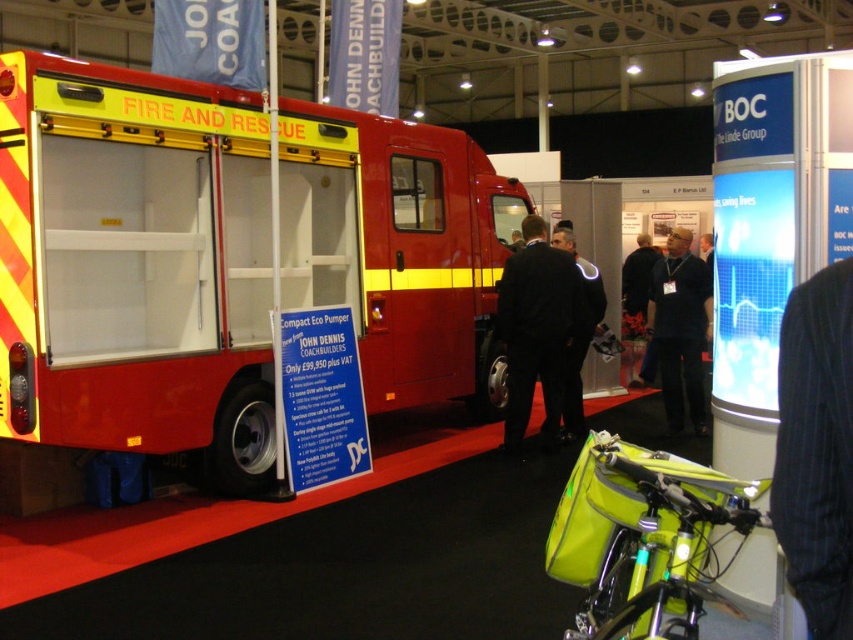
Between neon yellow fabric bag at lower right and black fabric suit at center, which one has more height?

black fabric suit at center is taller.

The image size is (853, 640). What are the coordinates of `neon yellow fabric bag at lower right` in the screenshot? It's located at (642, 538).

Consider the image. Who is more distant from viewer, (x=641, y=515) or (x=672, y=394)?

Positioned behind is point (x=672, y=394).

Is neon yellow fabric bag at lower right further to camera compared to dark blue shirt at center?

No, neon yellow fabric bag at lower right is in front of dark blue shirt at center.

Who is more forward, (645, 612) or (664, 323)?

Point (645, 612) is in front.

Image resolution: width=853 pixels, height=640 pixels. In order to click on neon yellow fabric bag at lower right in this screenshot , I will do `click(642, 538)`.

Which is in front, point (688, 349) or point (579, 432)?

Point (688, 349) is in front.

Does point (653, 317) come in front of point (560, 243)?

Yes, it is in front of point (560, 243).

The height and width of the screenshot is (640, 853). Identify the location of dark blue shirt at center. (680, 330).